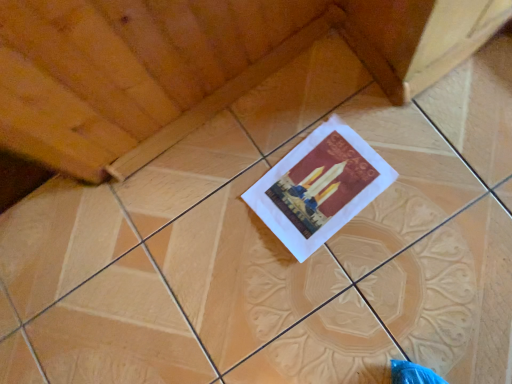
Locate an element on the screen. spots to the right of matte paper postcard at center is located at coordinates (403, 130).